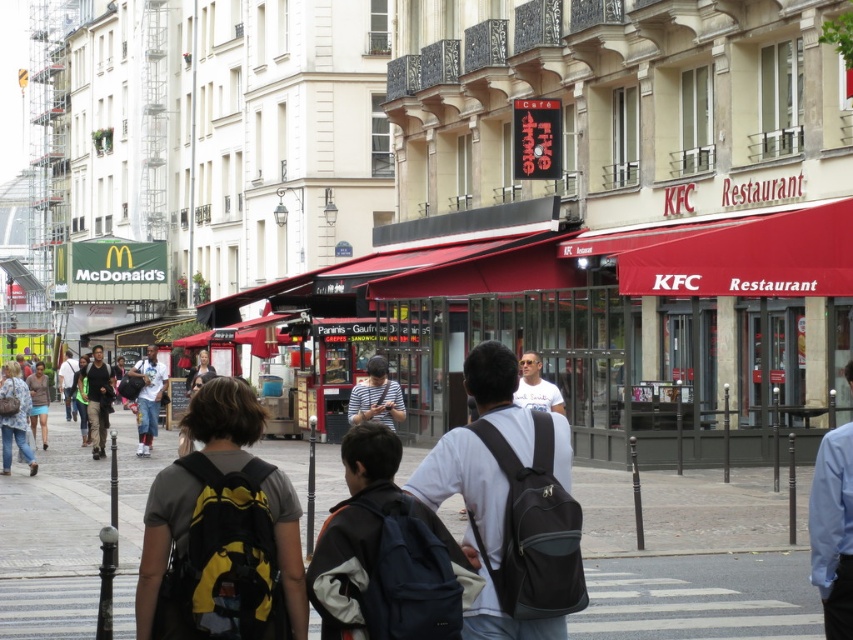
Is denim jacket at lower left wider than white t-shirt at center?

Yes, denim jacket at lower left is wider than white t-shirt at center.

Is point (0, 394) behind point (538, 364)?

Yes.

Image resolution: width=853 pixels, height=640 pixels. Identify the location of denim jacket at lower left. (15, 417).

Can you confirm if dark gray backpack at left is shorter than light brown leather jacket at center?

No, dark gray backpack at left is not shorter than light brown leather jacket at center.

You are a GUI agent. You are given a task and a screenshot of the screen. Output one action in this format:
    pyautogui.click(x=<x>, y=<y>)
    Task: Click on the dark gray backpack at left
    The height and width of the screenshot is (640, 853).
    Given the screenshot: What is the action you would take?
    pyautogui.click(x=97, y=400)

I want to click on dark gray backpack at left, so click(97, 400).

Does black matte backpack at center appear over denim jacket at lower left?

Correct, black matte backpack at center is located above denim jacket at lower left.

Who is lower down, black matte backpack at center or denim jacket at lower left?

denim jacket at lower left is below.

Which is behind, point (509, 538) or point (10, 419)?

The point (10, 419) is behind.

Locate an element on the screen. The height and width of the screenshot is (640, 853). black matte backpack at center is located at coordinates (511, 504).